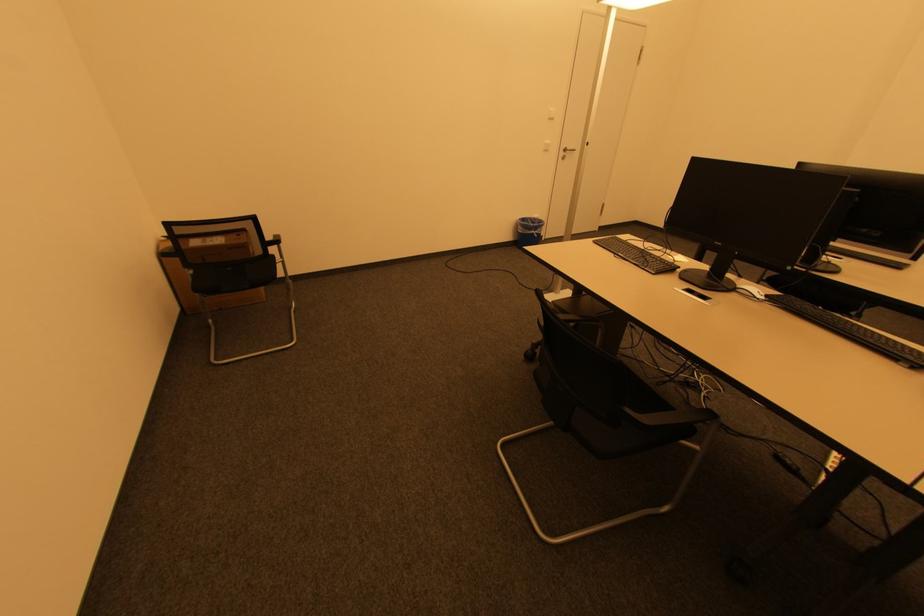
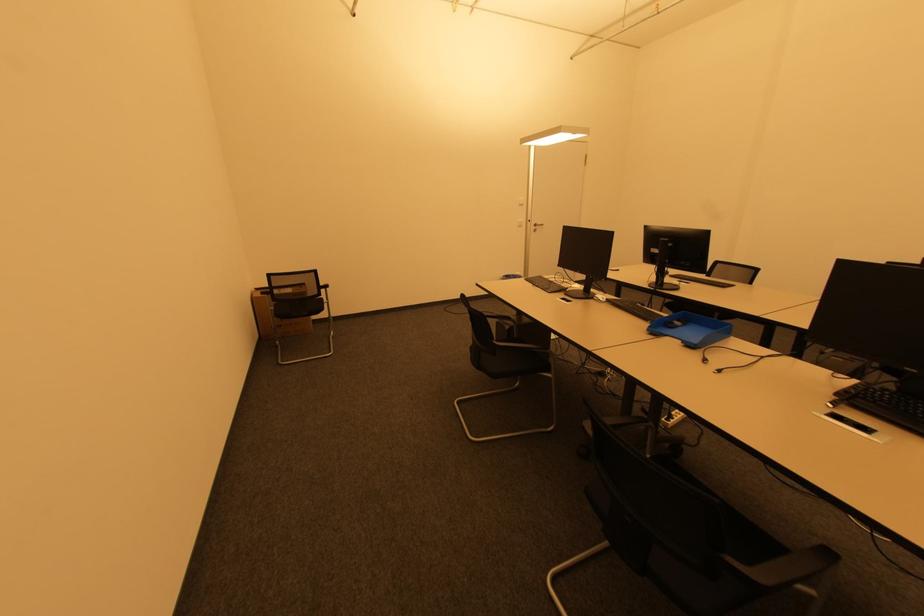
Which direction would the cameraman need to move to produce the second image?

The movement direction of the cameraman is right, backward.